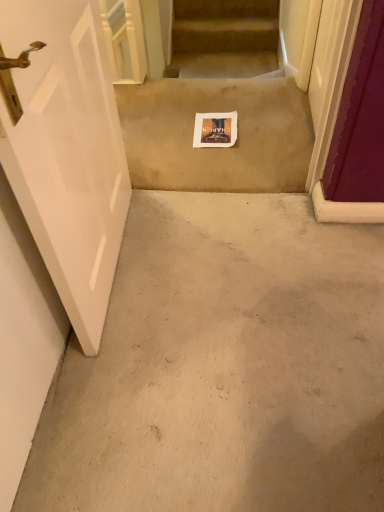
Question: Is beige carpet at center closer to the viewer compared to white glossy door at left?

Choices:
 (A) no
 (B) yes

Answer: (A)

Question: Considering the relative sizes of beige carpet at center and white glossy door at left in the image provided, is beige carpet at center taller than white glossy door at left?

Choices:
 (A) no
 (B) yes

Answer: (A)

Question: Is beige carpet at center shorter than white glossy door at left?

Choices:
 (A) yes
 (B) no

Answer: (A)

Question: Considering the relative sizes of beige carpet at center and white glossy door at left in the image provided, is beige carpet at center smaller than white glossy door at left?

Choices:
 (A) yes
 (B) no

Answer: (A)

Question: From the image's perspective, is beige carpet at center over white glossy door at left?

Choices:
 (A) yes
 (B) no

Answer: (A)

Question: Is beige carpet at center outside white glossy door at left?

Choices:
 (A) no
 (B) yes

Answer: (B)

Question: Does white glossy door at left have a greater width compared to beige carpet at center?

Choices:
 (A) yes
 (B) no

Answer: (B)

Question: Can you confirm if white glossy door at left is smaller than beige carpet at center?

Choices:
 (A) no
 (B) yes

Answer: (A)

Question: Is white glossy door at left shorter than beige carpet at center?

Choices:
 (A) yes
 (B) no

Answer: (B)

Question: Is white glossy door at left at the left side of beige carpet at center?

Choices:
 (A) no
 (B) yes

Answer: (B)

Question: Considering the relative sizes of white glossy door at left and beige carpet at center in the image provided, is white glossy door at left bigger than beige carpet at center?

Choices:
 (A) no
 (B) yes

Answer: (B)

Question: Could you tell me if white glossy door at left is turned towards beige carpet at center?

Choices:
 (A) no
 (B) yes

Answer: (A)

Question: Does point (87, 215) appear closer or farther from the camera than point (266, 66)?

Choices:
 (A) closer
 (B) farther

Answer: (A)